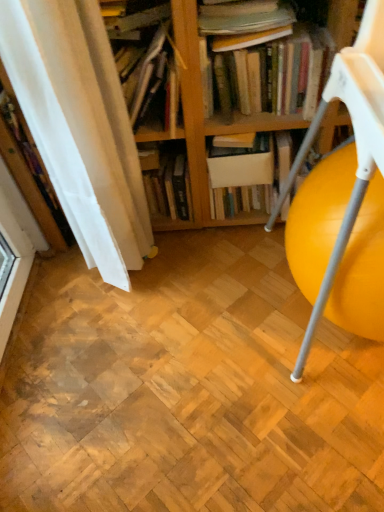
Question: Is wooden bookshelf at upper center, placed as the first book when sorted from left to right, smaller than hardcover book at center, the 2th book when ordered from left to right?

Choices:
 (A) no
 (B) yes

Answer: (A)

Question: From the image's perspective, is wooden bookshelf at upper center, placed as the first book when sorted from left to right, located beneath hardcover book at center, which appears as the second book when viewed from the right?

Choices:
 (A) yes
 (B) no

Answer: (B)

Question: From a real-world perspective, is wooden bookshelf at upper center, placed as the first book when sorted from left to right, on hardcover book at center, which appears as the second book when viewed from the right?

Choices:
 (A) no
 (B) yes

Answer: (B)

Question: Does wooden bookshelf at upper center, positioned as the third book in right-to-left order, have a greater width compared to hardcover book at center, the 2th book when ordered from left to right?

Choices:
 (A) no
 (B) yes

Answer: (B)

Question: Is hardcover book at center, which appears as the second book when viewed from the right, located within wooden bookshelf at upper center, placed as the first book when sorted from left to right?

Choices:
 (A) no
 (B) yes

Answer: (A)

Question: Are wooden bookshelf at upper center, positioned as the third book in right-to-left order, and hardcover book at center, which appears as the second book when viewed from the right, making contact?

Choices:
 (A) yes
 (B) no

Answer: (B)

Question: Is wooden bookshelf at upper center, positioned as the third book in right-to-left order, not inside white matte book at center?

Choices:
 (A) no
 (B) yes

Answer: (B)

Question: Does wooden bookshelf at upper center, positioned as the third book in right-to-left order, contain white matte book at center?

Choices:
 (A) yes
 (B) no

Answer: (B)

Question: Is wooden bookshelf at upper center, positioned as the third book in right-to-left order, wider than white matte book at center?

Choices:
 (A) no
 (B) yes

Answer: (B)

Question: Is wooden bookshelf at upper center, placed as the first book when sorted from left to right, smaller than white matte book at center?

Choices:
 (A) no
 (B) yes

Answer: (A)

Question: Are wooden bookshelf at upper center, positioned as the third book in right-to-left order, and white matte book at center beside each other?

Choices:
 (A) yes
 (B) no

Answer: (B)

Question: Does wooden bookshelf at upper center, placed as the first book when sorted from left to right, come in front of white matte book at center?

Choices:
 (A) no
 (B) yes

Answer: (B)

Question: Is yellow plastic ball at right taller than hardcover books at upper center, the first book viewed from the right?

Choices:
 (A) no
 (B) yes

Answer: (B)